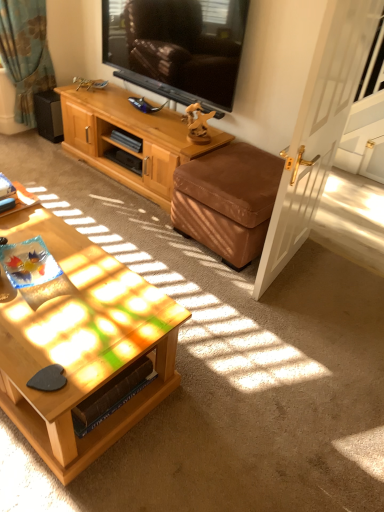
Identify the location of vacant space situated on the left part of brown leather ottoman at lower right. The width and height of the screenshot is (384, 512). (147, 232).